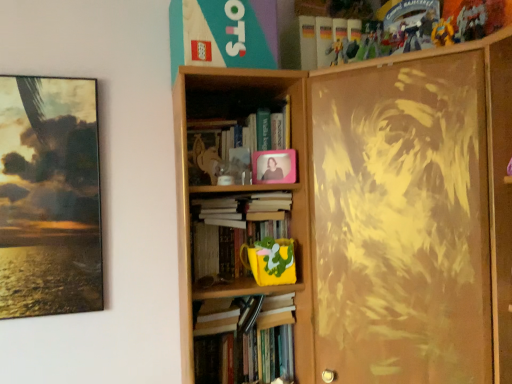
Identify the location of matte plastic picture frame at upper center. Image resolution: width=512 pixels, height=384 pixels. (274, 166).

Based on the photo, measure the distance between point (376, 260) and camera.

Point (376, 260) is 1.23 meters away from camera.

Locate an element on the screen. This screenshot has width=512, height=384. yellow matte mug at center, the second book from the top is located at coordinates (252, 235).

Locate an element on the screen. hardcover book at center, which appears as the 1th book when ordered from the bottom is located at coordinates (246, 341).

The image size is (512, 384). Describe the element at coordinates (443, 33) in the screenshot. I see `yellow matte action figure at upper right` at that location.

In order to click on matte plastic picture frame at upper center in this screenshot , I will do `click(274, 166)`.

From the matte paper book at upper center, count 1st book to the right and point to it. Please provide its 2D coordinates.

[(252, 235)]

From the image's perspective, is matte paper book at upper center located above yellow matte mug at center, the second book positioned from the bottom?

Indeed, from the image's perspective, matte paper book at upper center is shown above yellow matte mug at center, the second book positioned from the bottom.

Do you think matte paper book at upper center is within yellow matte mug at center, the second book from the top, or outside of it?

matte paper book at upper center is not enclosed by yellow matte mug at center, the second book from the top.

Is point (246, 141) positioned in front of point (195, 326)?

That is False.

In terms of width, does pink matte photo frame at upper center, which appears as the first book when viewed from the top, look wider or thinner when compared to hardcover book at center, which appears as the 1th book when ordered from the bottom?

Clearly, pink matte photo frame at upper center, which appears as the first book when viewed from the top, has more width compared to hardcover book at center, which appears as the 1th book when ordered from the bottom.

Does pink matte photo frame at upper center, which appears as the first book when viewed from the top, appear on the right side of hardcover book at center, which appears as the 1th book when ordered from the bottom?

In fact, pink matte photo frame at upper center, which appears as the first book when viewed from the top, is to the left of hardcover book at center, which appears as the 1th book when ordered from the bottom.

Is pink matte photo frame at upper center, placed as the third book when sorted from bottom to top, positioned with its back to hardcover book at center, which appears as the 1th book when ordered from the bottom?

No, hardcover book at center, which appears as the 1th book when ordered from the bottom, is not at the back of pink matte photo frame at upper center, placed as the third book when sorted from bottom to top.

How different are the orientations of wooden bookcase at center, which is the 2th bookcase in right-to-left order, and hardcover book at center, the 3th book from the top, in degrees?

wooden bookcase at center, which is the 2th bookcase in right-to-left order, and hardcover book at center, the 3th book from the top, are facing 1.51 degrees away from each other.

From the picture: From the image's perspective, is wooden bookcase at center, which is the 2th bookcase in right-to-left order, above or below hardcover book at center, the 3th book from the top?

Based on their image positions, wooden bookcase at center, which is the 2th bookcase in right-to-left order, is located above hardcover book at center, the 3th book from the top.

Does point (289, 100) appear closer or farther from the camera than point (279, 340)?

Clearly, point (289, 100) is closer to the camera than point (279, 340).

Is wooden bookcase at center, which is the 2th bookcase in right-to-left order, facing towards hardcover book at center, which appears as the 1th book when ordered from the bottom?

Yes, wooden bookcase at center, which is the 2th bookcase in right-to-left order, is facing hardcover book at center, which appears as the 1th book when ordered from the bottom.

Considering the sizes of objects yellow matte action figure at upper right and wooden bookcase at center, which is the 2th bookcase in right-to-left order, in the image provided, who is shorter, yellow matte action figure at upper right or wooden bookcase at center, which is the 2th bookcase in right-to-left order,?

yellow matte action figure at upper right.

From a real-world perspective, is yellow matte action figure at upper right located higher than wooden bookcase at center, the 1th bookcase in the left-to-right sequence?

Yes.

Is point (441, 28) positioned before point (270, 83)?

No, (441, 28) is further to viewer.

Is yellow matte action figure at upper right turned away from wooden bookcase at center, which is the 2th bookcase in right-to-left order?

No, wooden bookcase at center, which is the 2th bookcase in right-to-left order, is not at the back of yellow matte action figure at upper right.

From the image's perspective, does matte brown painting at right, the 1th bookcase viewed from the right, appear lower than hardcover book at center, which appears as the 1th book when ordered from the bottom?

No.

From a real-world perspective, is matte brown painting at right, the 1th bookcase viewed from the right, above or below hardcover book at center, the 3th book from the top?

matte brown painting at right, the 1th bookcase viewed from the right, is above hardcover book at center, the 3th book from the top.

Is matte brown painting at right, the 1th bookcase viewed from the right, looking in the opposite direction of hardcover book at center, which appears as the 1th book when ordered from the bottom?

matte brown painting at right, the 1th bookcase viewed from the right, does not have its back to hardcover book at center, which appears as the 1th book when ordered from the bottom.

What's the angular difference between matte brown painting at right, the 1th bookcase viewed from the right, and hardcover book at center, which appears as the 1th book when ordered from the bottom,'s facing directions?

They differ by 43.9 degrees in their facing directions.

Does point (209, 154) appear closer or farther from the camera than point (187, 7)?

Point (209, 154).

Is pink matte photo frame at upper center, placed as the third book when sorted from bottom to top, situated inside matte paper book at upper center or outside?

pink matte photo frame at upper center, placed as the third book when sorted from bottom to top, is outside matte paper book at upper center.

From the image's perspective, which object appears higher, pink matte photo frame at upper center, placed as the third book when sorted from bottom to top, or matte paper book at upper center?

matte paper book at upper center.

From a real-world perspective, is pink matte photo frame at upper center, which appears as the first book when viewed from the top, positioned above or below matte paper book at upper center?

pink matte photo frame at upper center, which appears as the first book when viewed from the top, is situated lower than matte paper book at upper center in the real world.

Who is bigger, matte paper book at upper center or matte plastic picture frame at upper center?

matte paper book at upper center is bigger.

Who is shorter, matte paper book at upper center or matte plastic picture frame at upper center?

With less height is matte plastic picture frame at upper center.

Does matte paper book at upper center turn towards matte plastic picture frame at upper center?

No, matte paper book at upper center is not aimed at matte plastic picture frame at upper center.

Is matte paper book at upper center outside of matte plastic picture frame at upper center?

Yes, matte paper book at upper center is outside of matte plastic picture frame at upper center.

Locate an element on the screen. The width and height of the screenshot is (512, 384). the 1st book counting from the right side of the matte paper book at upper center is located at coordinates 252,235.

Locate an element on the screen. Image resolution: width=512 pixels, height=384 pixels. the 2nd book located beneath the pink matte photo frame at upper center, placed as the third book when sorted from bottom to top (from a real-world perspective) is located at coordinates (246, 341).

Which object lies nearer to the anchor point wooden bookcase at center, which is the 2th bookcase in right-to-left order, matte brown painting at right, arranged as the second bookcase when viewed from the left, or hardcover book at center, the 3th book from the top?

Based on the image, matte brown painting at right, arranged as the second bookcase when viewed from the left, appears to be nearer to wooden bookcase at center, which is the 2th bookcase in right-to-left order.

Based on the photo, estimate the real-world distances between objects in this image. Which object is closer to matte paper book at upper center, yellow matte action figure at upper right or pink matte photo frame at upper center, placed as the third book when sorted from bottom to top?

pink matte photo frame at upper center, placed as the third book when sorted from bottom to top, is positioned closer to the anchor matte paper book at upper center.

Which object lies further to the anchor point yellow matte mug at center, the second book positioned from the bottom, hardcover book at center, the 3th book from the top, or yellow matte action figure at upper right?

The object further to yellow matte mug at center, the second book positioned from the bottom, is yellow matte action figure at upper right.

Looking at the image, which one is located further to yellow matte mug at center, the second book positioned from the bottom, matte brown painting at right, the 1th bookcase viewed from the right, or yellow matte action figure at upper right?

yellow matte action figure at upper right lies further to yellow matte mug at center, the second book positioned from the bottom, than the other object.

In the scene shown: Estimate the real-world distances between objects in this image. Which object is closer to hardcover book at center, the 3th book from the top, yellow matte mug at center, the second book from the top, or wooden bookcase at center, which is the 2th bookcase in right-to-left order?

wooden bookcase at center, which is the 2th bookcase in right-to-left order, is positioned closer to the anchor hardcover book at center, the 3th book from the top.

Which object lies nearer to the anchor point matte brown painting at right, arranged as the second bookcase when viewed from the left, hardcover book at center, the 3th book from the top, or wooden bookcase at center, which is the 2th bookcase in right-to-left order?

wooden bookcase at center, which is the 2th bookcase in right-to-left order, lies closer to matte brown painting at right, arranged as the second bookcase when viewed from the left, than the other object.

Looking at the image, which one is located closer to matte paper book at upper center, pink matte photo frame at upper center, which appears as the first book when viewed from the top, or yellow matte mug at center, the second book positioned from the bottom?

pink matte photo frame at upper center, which appears as the first book when viewed from the top, is positioned closer to the anchor matte paper book at upper center.

Estimate the real-world distances between objects in this image. Which object is further from yellow matte action figure at upper right, matte plastic picture frame at upper center or matte paper book at upper center?

Among the two, matte plastic picture frame at upper center is located further to yellow matte action figure at upper right.

Identify the location of picture frame between pink matte photo frame at upper center, which appears as the first book when viewed from the top, and matte brown painting at right, the 1th bookcase viewed from the right. The height and width of the screenshot is (384, 512). (274, 166).

Find the location of a particular element. book between wooden bookcase at center, the 1th bookcase in the left-to-right sequence, and hardcover book at center, which appears as the 1th book when ordered from the bottom, vertically is located at coordinates (252, 235).

Locate an element on the screen. The image size is (512, 384). book between wooden bookcase at center, which is the 2th bookcase in right-to-left order, and matte brown painting at right, the 1th bookcase viewed from the right is located at coordinates (246, 341).

This screenshot has width=512, height=384. In order to click on picture frame between wooden bookcase at center, the 1th bookcase in the left-to-right sequence, and matte brown painting at right, arranged as the second bookcase when viewed from the left in this screenshot , I will do `click(274, 166)`.